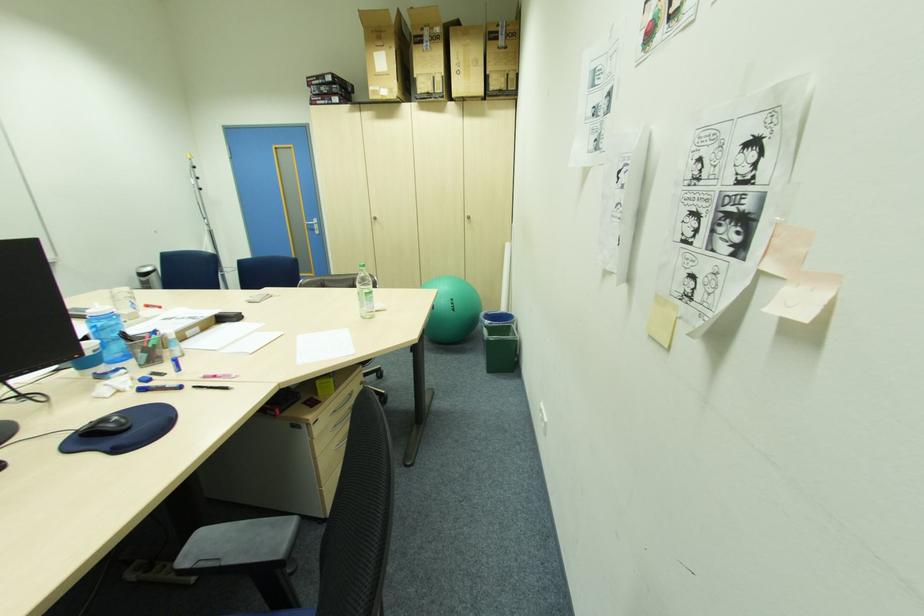
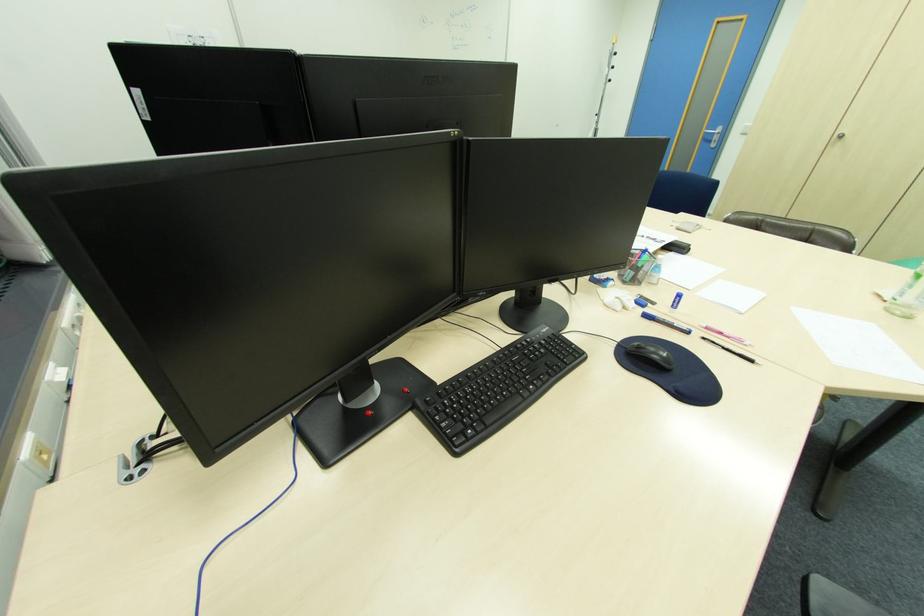
In the second image, find the point that corresponds to the point at 199,387 in the first image.

(709, 339)